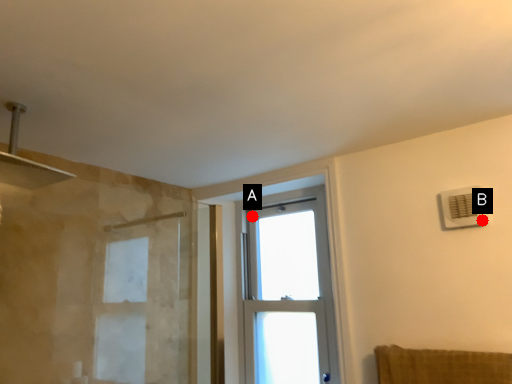
Question: Two points are circled on the image, labeled by A and B beside each circle. Which of the following is the closest to the observer?

Choices:
 (A) A is closer
 (B) B is closer

Answer: (B)